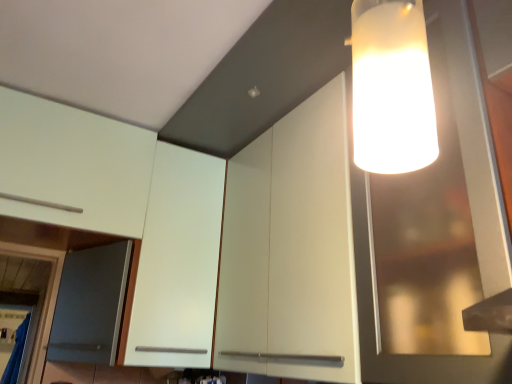
Question: Considering the positions of white matte cabinet at upper left, marked as the second cabinetry in a right-to-left arrangement, and white matte cabinet at upper right, arranged as the 1th cabinetry when viewed from the right, in the image, is white matte cabinet at upper left, marked as the second cabinetry in a right-to-left arrangement, taller or shorter than white matte cabinet at upper right, arranged as the 1th cabinetry when viewed from the right,?

Choices:
 (A) tall
 (B) short

Answer: (A)

Question: Is white matte cabinet at upper left, arranged as the 2th cabinetry when viewed from the left, wider or thinner than white matte cabinet at upper right, placed as the third cabinetry when sorted from left to right?

Choices:
 (A) thin
 (B) wide

Answer: (B)

Question: Which object is positioned farthest from the white matte cabinet at upper left, which ranks as the first cabinetry in left-to-right order?

Choices:
 (A) transparent glass cabinet at upper right
 (B) white matte cabinet at upper right, placed as the third cabinetry when sorted from left to right
 (C) white matte cabinet at upper left, arranged as the 2th cabinetry when viewed from the left

Answer: (A)

Question: Which object is positioned closest to the white matte cabinet at upper left, which ranks as the first cabinetry in left-to-right order?

Choices:
 (A) white matte cabinet at upper right, arranged as the 1th cabinetry when viewed from the right
 (B) transparent glass cabinet at upper right
 (C) white matte cabinet at upper left, arranged as the 2th cabinetry when viewed from the left

Answer: (C)